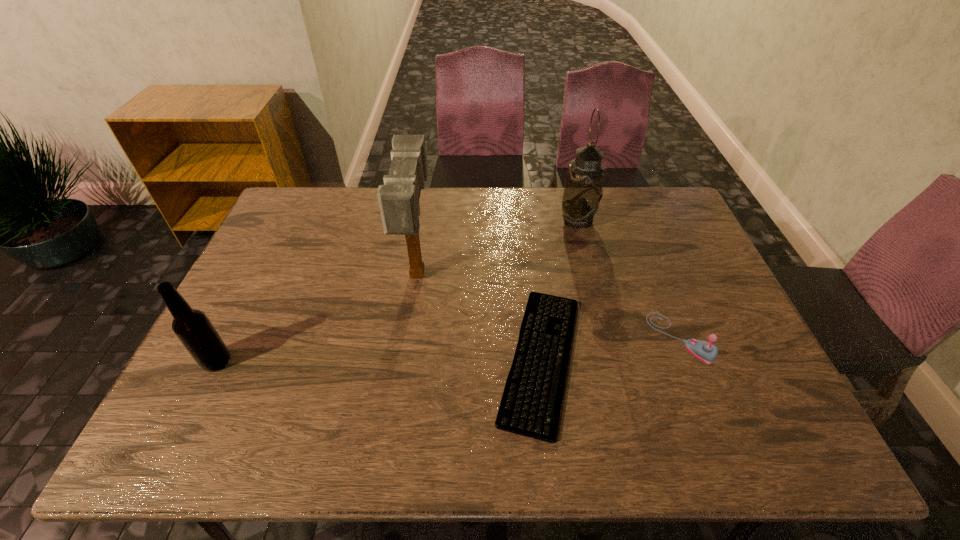
Locate an element on the screen. This screenshot has height=540, width=960. vacant space located 0.130m on the front of the rightmost object is located at coordinates (711, 415).

Locate an element on the screen. This screenshot has width=960, height=540. vacant region located on the left of the computer keyboard is located at coordinates (469, 358).

Where is `object present at the far edge`? Image resolution: width=960 pixels, height=540 pixels. object present at the far edge is located at coordinates (583, 191).

This screenshot has width=960, height=540. In order to click on object present at the near edge in this screenshot , I will do `click(530, 406)`.

The width and height of the screenshot is (960, 540). Find the location of `object located at the left edge`. object located at the left edge is located at coordinates (195, 331).

Locate an element on the screen. Image resolution: width=960 pixels, height=540 pixels. object that is at the right edge is located at coordinates tap(705, 351).

Where is `vacant space at the far edge`? vacant space at the far edge is located at coordinates (446, 192).

Identify the location of vacant space at the near edge of the desktop. (492, 427).

In the image, there is a desktop. Where is `vacant space at the left edge`? This screenshot has width=960, height=540. vacant space at the left edge is located at coordinates (277, 322).

The height and width of the screenshot is (540, 960). In order to click on free space at the far left corner in this screenshot , I will do `click(311, 195)`.